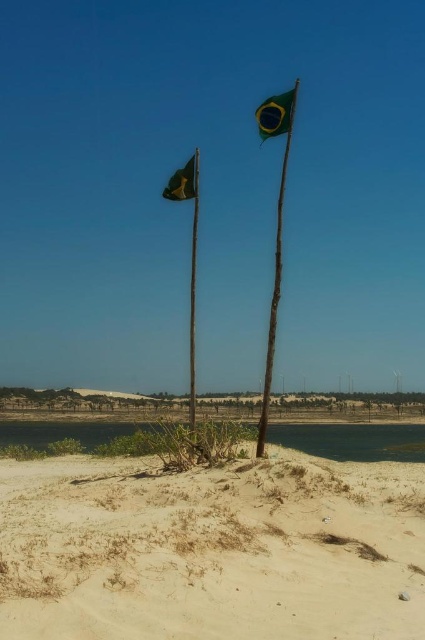
You are a hiker who needs to cross the desert. You see clear water at lower center and a green fabric flag at center. Which one is wider? Please choose between the two.

The clear water at lower center is wider than the green fabric flag at center.